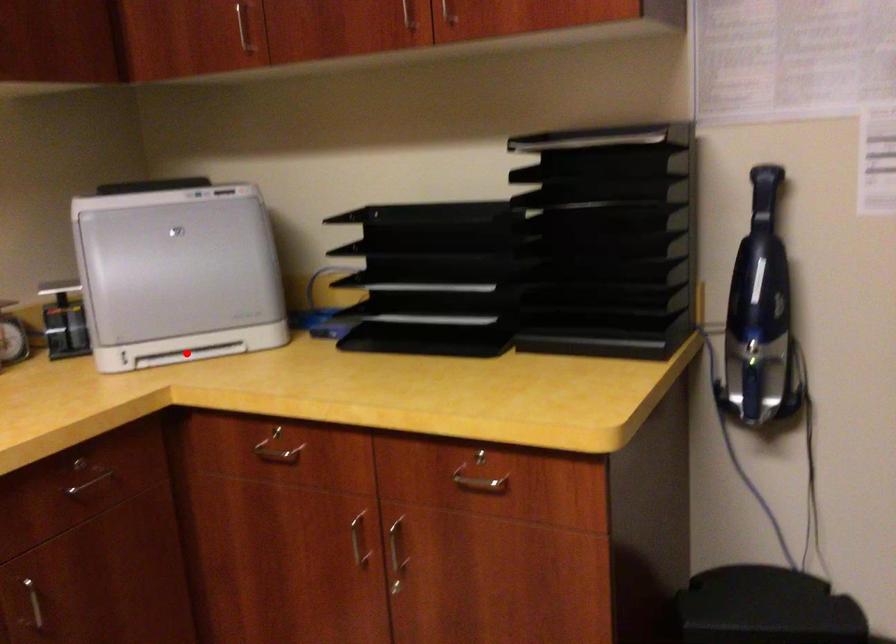
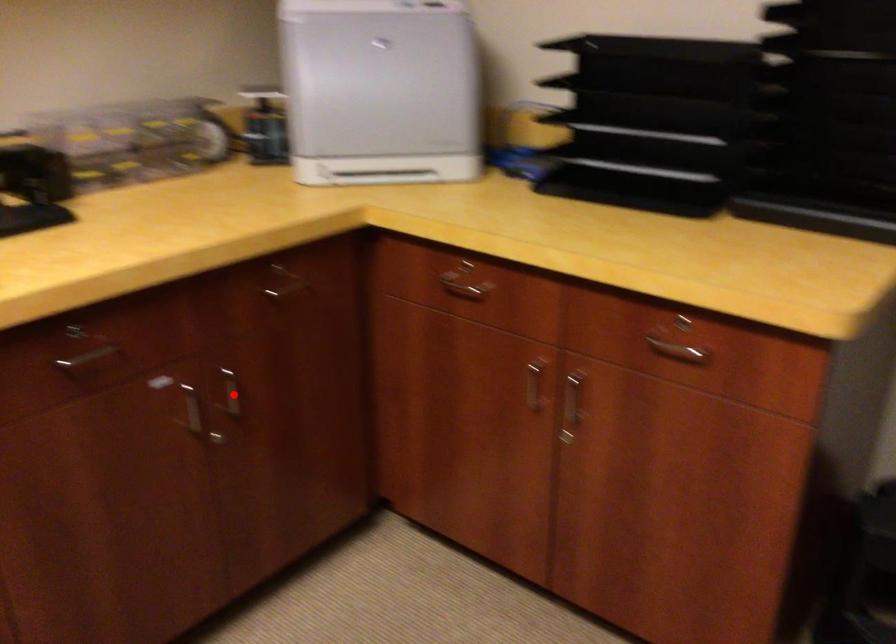
I am providing you with two images of the same scene from different viewpoints. A red point is marked on the first image and another point is marked on the second image. Does the point marked in image1 correspond to the same location as the one in image2?

No